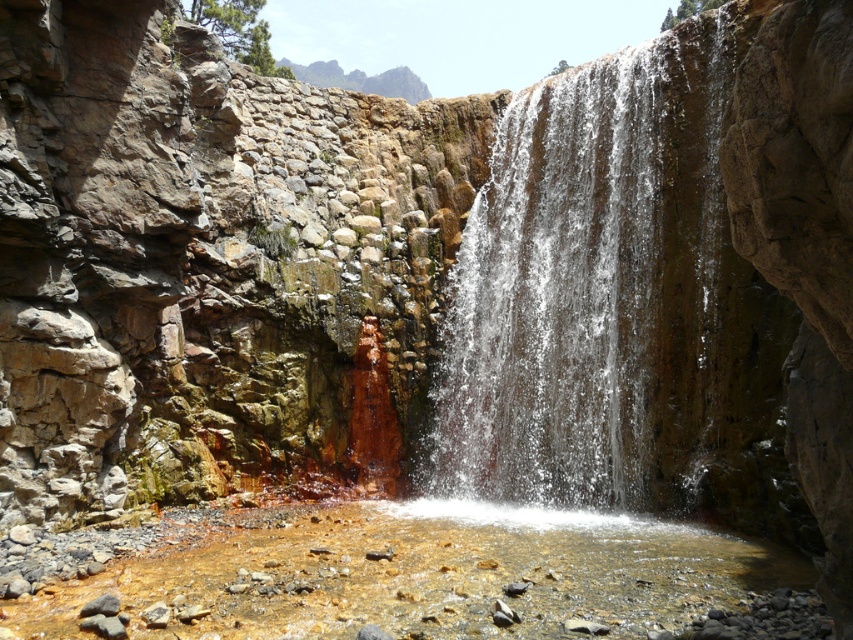
Question: Does clear water at center appear on the left side of translucent amber water at center?

Choices:
 (A) yes
 (B) no

Answer: (B)

Question: Is clear water at center positioned in front of translucent amber water at center?

Choices:
 (A) no
 (B) yes

Answer: (A)

Question: Does clear water at center appear on the right side of translucent amber water at center?

Choices:
 (A) no
 (B) yes

Answer: (B)

Question: Which object appears farthest from the camera in this image?

Choices:
 (A) translucent amber water at center
 (B) clear water at center

Answer: (B)

Question: Which of the following is the farthest from the observer?

Choices:
 (A) clear water at center
 (B) translucent amber water at center

Answer: (A)